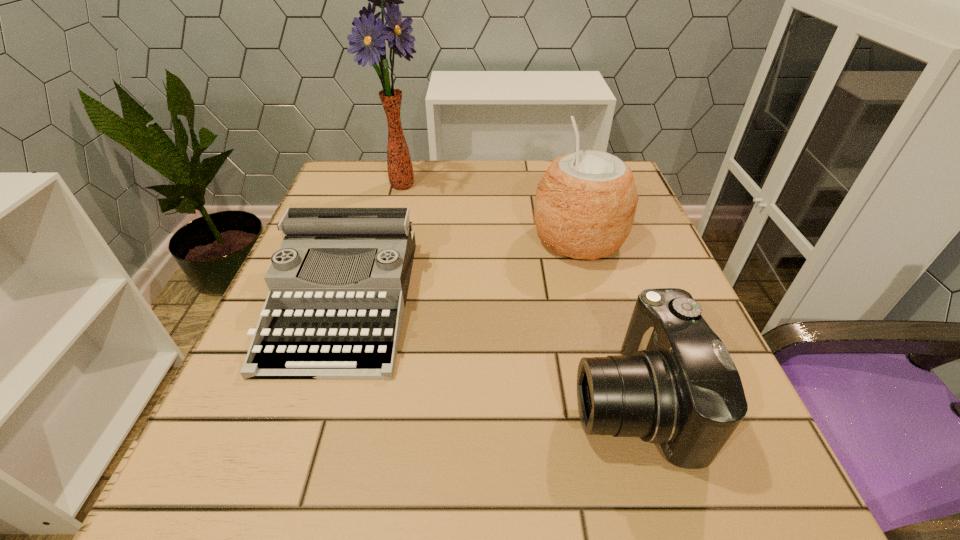
You are a GUI agent. You are given a task and a screenshot of the screen. Output one action in this format:
    pyautogui.click(x=<x>, y=<y>)
    Task: Click on the vacant space at the left edge
    
    Given the screenshot: What is the action you would take?
    pyautogui.click(x=276, y=414)

Locate an element on the screen. This screenshot has width=960, height=540. free space at the right edge of the desktop is located at coordinates (627, 315).

Locate an element on the screen. free spot at the far left corner of the desktop is located at coordinates (370, 161).

The image size is (960, 540). In order to click on vacant region at the near right corner of the desktop in this screenshot , I will do `click(773, 467)`.

Locate an element on the screen. This screenshot has height=540, width=960. free space between the camera and the farthest object is located at coordinates [516, 292].

I want to click on free space between the second shortest object and the typewriter, so click(487, 351).

Identify the location of vacant area between the camera and the third shortest object. (605, 320).

Identify the location of free spot between the second tallest object and the third tallest object. The image size is (960, 540). (605, 320).

Locate an element on the screen. The height and width of the screenshot is (540, 960). free point between the camera and the shortest object is located at coordinates (487, 351).

The image size is (960, 540). Identify the location of object that is the third nearest to the second shortest object. (368, 39).